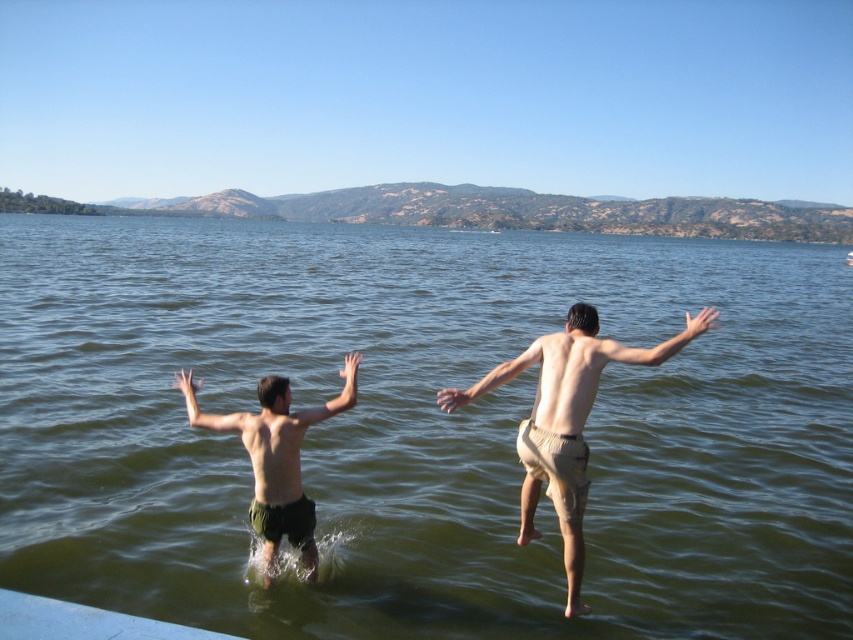
Question: Where is green water at center located in relation to dark green shorts at left in the image?

Choices:
 (A) below
 (B) above

Answer: (B)

Question: Estimate the real-world distances between objects in this image. Which object is closer to the dark green shorts at left?

Choices:
 (A) green water at center
 (B) tan fabric shorts at center

Answer: (B)

Question: Is tan fabric shorts at center further to camera compared to dark green shorts at left?

Choices:
 (A) no
 (B) yes

Answer: (A)

Question: Which point is farther from the camera taking this photo?

Choices:
 (A) (289, 486)
 (B) (460, 294)
 (C) (573, 307)

Answer: (B)

Question: Considering the relative positions of tan fabric shorts at center and dark green shorts at left in the image provided, where is tan fabric shorts at center located with respect to dark green shorts at left?

Choices:
 (A) below
 (B) above

Answer: (B)

Question: Which object is the closest to the dark green shorts at left?

Choices:
 (A) green water at center
 (B) tan fabric shorts at center

Answer: (B)